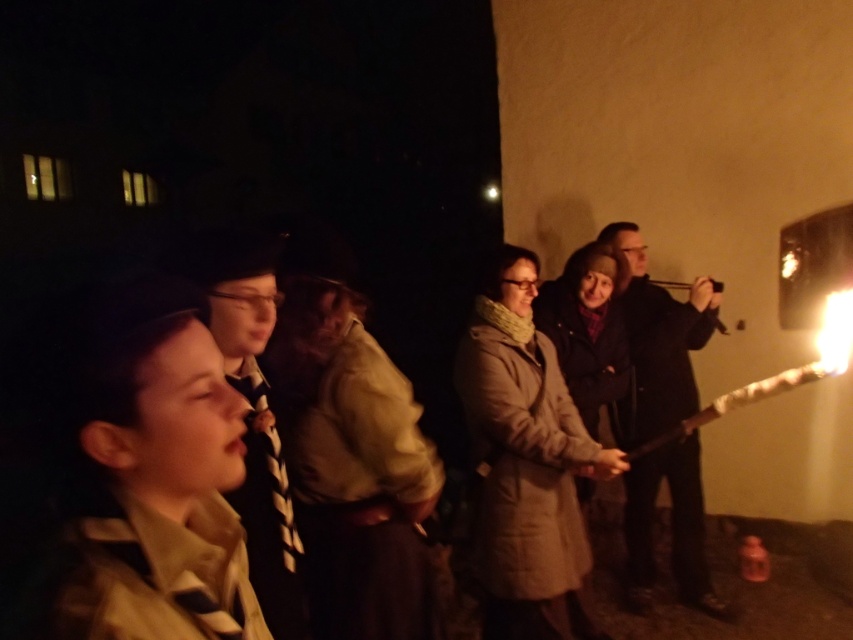
You are a photographer at the event and want to capture both the light brown leather jacket at center and the striped tie at center in a single frame. Which object should you focus on first to ensure both are in the shot?

The light brown leather jacket at center is positioned on the right side of striped tie at center, so you should focus on the striped tie at center first to ensure both are in the shot.